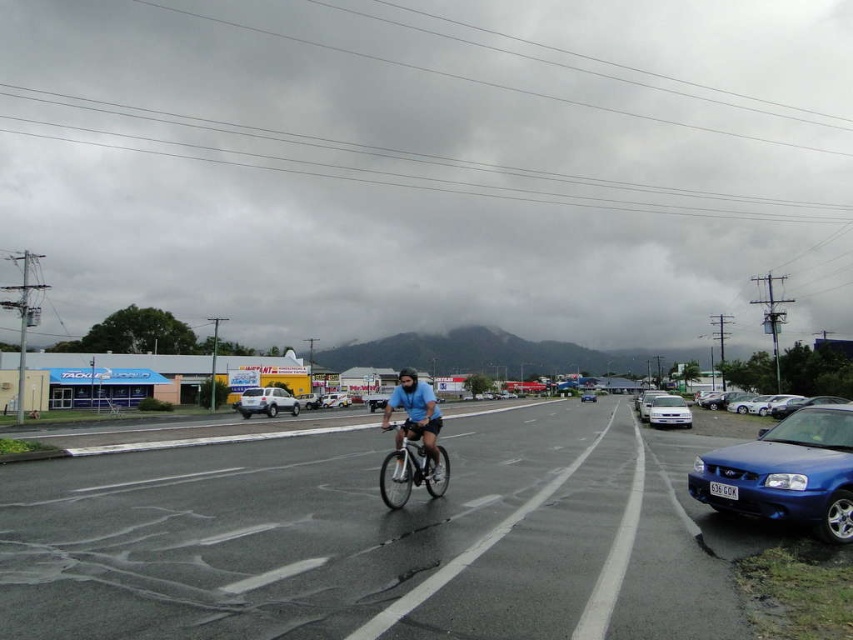
You are a delivery driver who needs to park your car next to the metallic blue sedan at right. However, there is a shiny metallic bicycle at center blocking the parking spot. Which object should you move to access the parking spot?

You need to move the shiny metallic bicycle at center because the metallic blue sedan at right is positioned under it, meaning the bicycle is blocking the parking spot.

You are a delivery driver who needs to park your car 6 meters away from the blue matte bicycle at center. Can you park your car near the metallic blue sedan at right?

The metallic blue sedan at right is 5.71 meters away from the blue matte bicycle at center. Since your parking requirement is 6 meters, the metallic blue sedan at right is slightly closer than needed. You may need to park a bit further away to meet the 6 meters distance requirement.